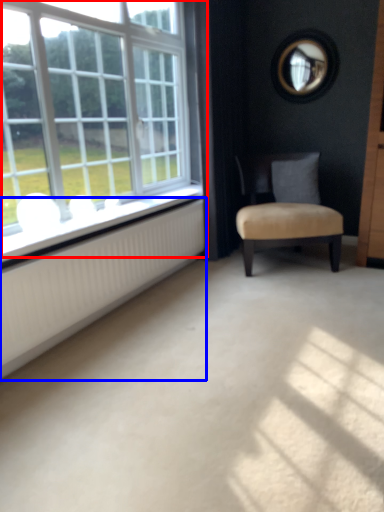
Question: Which object appears closest to the camera in this image, window (highlighted by a red box) or radiator (highlighted by a blue box)?

Choices:
 (A) window
 (B) radiator

Answer: (A)